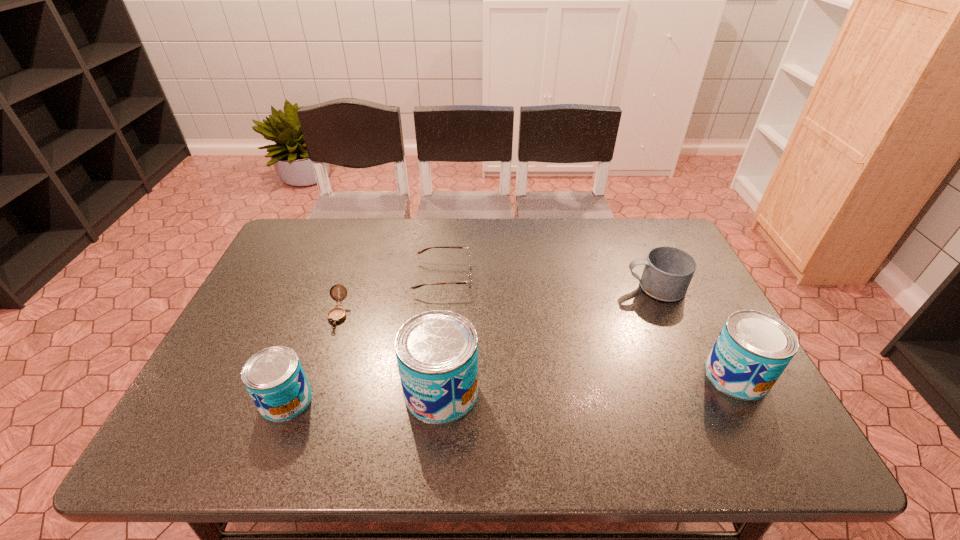
Locate an element on the screen. This screenshot has width=960, height=540. vacant space located on the right of the tallest object is located at coordinates (626, 392).

Identify the location of vacant space located 0.280m on the left of the rightmost can. This screenshot has height=540, width=960. (589, 375).

I want to click on blank space located 0.180m on the face of the compass, so click(x=313, y=388).

The height and width of the screenshot is (540, 960). I want to click on vacant space located on the front-facing side of the spectacles, so click(526, 276).

You are a GUI agent. You are given a task and a screenshot of the screen. Output one action in this format:
    pyautogui.click(x=<x>, y=<y>)
    Task: Click on the free space located 0.140m on the side of the third shortest object with the handle
    The image size is (960, 540).
    Given the screenshot: What is the action you would take?
    pyautogui.click(x=577, y=287)

Find the location of a particular element. Image resolution: width=960 pixels, height=540 pixels. free space located 0.400m on the side of the third shortest object with the handle is located at coordinates (488, 287).

Where is `free location located on the side of the third shortest object with the handle`? Image resolution: width=960 pixels, height=540 pixels. free location located on the side of the third shortest object with the handle is located at coordinates (488, 287).

Where is `object located in the far edge section of the desktop`? This screenshot has width=960, height=540. object located in the far edge section of the desktop is located at coordinates (468, 281).

The image size is (960, 540). What are the coordinates of `object present at the left edge` in the screenshot? It's located at (274, 377).

Find the location of a particular element. The image size is (960, 540). can at the right edge is located at coordinates pos(753,349).